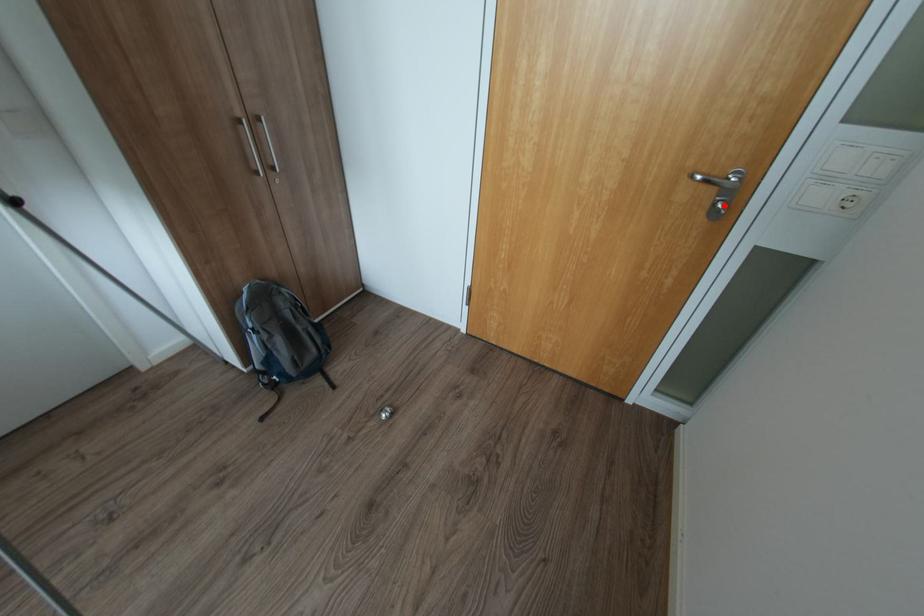
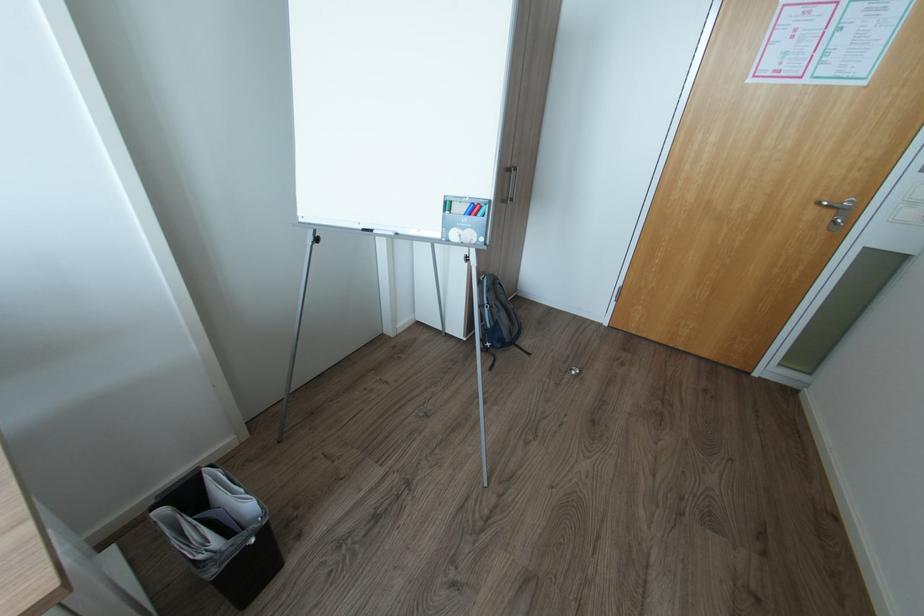
Question: I am providing you with two images of the same scene from different viewpoints. Image1 has a red point marked. In image2, the corresponding 3D location appears at what relative position? Reply with the corresponding letter.

Choices:
 (A) Closer
 (B) Farther

Answer: (B)